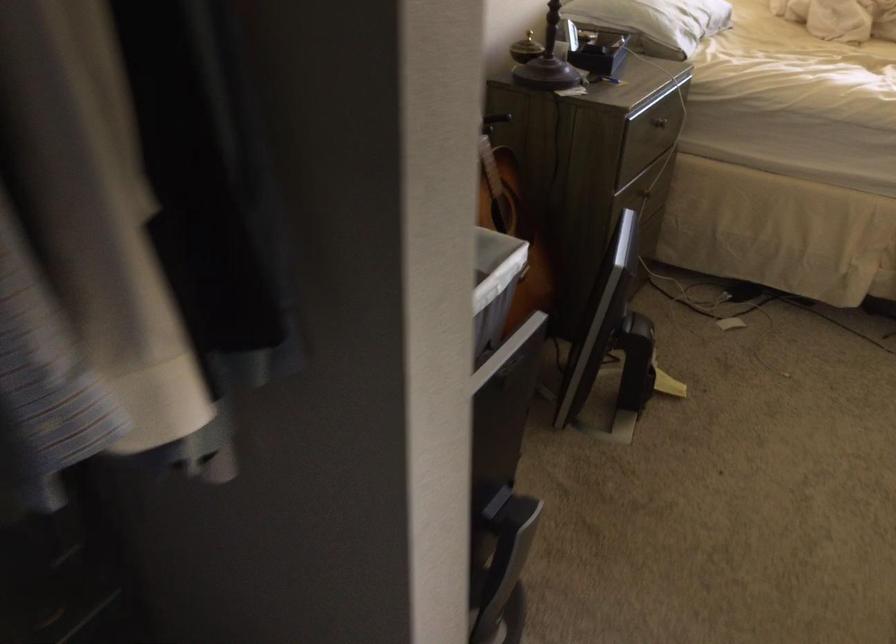
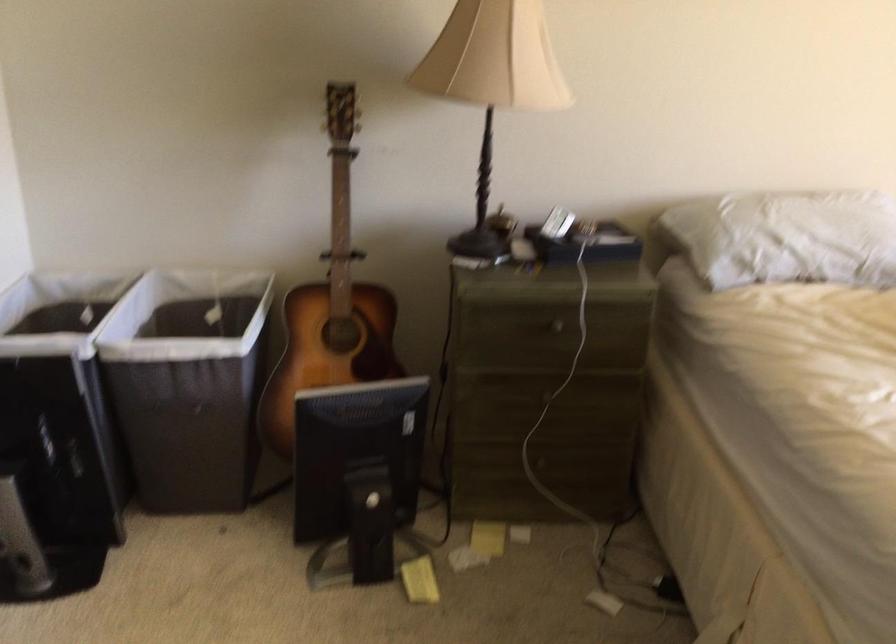
The point at [650,129] is marked in the first image. Where is the corresponding point in the second image?

(545, 328)